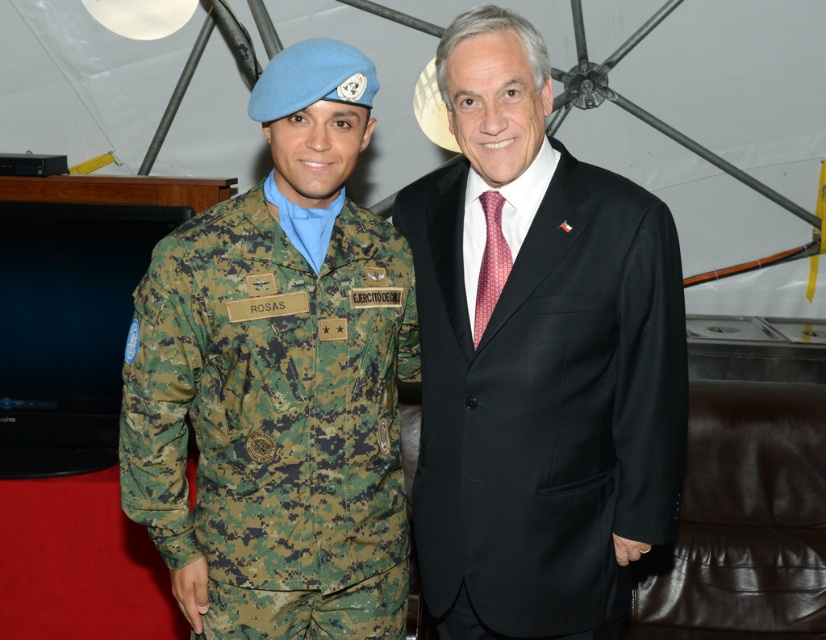
You are an event planner arranging seating for a formal dinner. You need to seat the two individuals shown in the image. The table has a height of 75 cm. Which of the two objects, the black satin suit at center or the camouflagetextured fabric at left, would require a higher chair to accommodate their clothing? Please explain your reasoning based on the provided information.

The black satin suit at center has a greater height compared to the camouflagetextured fabric at left. Therefore, the individual wearing the black satin suit at center would require a higher chair to accommodate their clothing since their outfit is taller.

You are a photographer at a formal event. You need to capture a photo where both the camouflagetextured fabric at left and the red dotted fabric tie at center are clearly visible. Considering their heights, which object should you focus on first to ensure both are in frame?

The camouflagetextured fabric at left is much taller than the red dotted fabric tie at center. To ensure both are in frame, focus on the taller camouflagetextured fabric at left first, then adjust the camera angle to include the shorter red dotted fabric tie at center.

You are a photographer at a formal event. You need to capture a closeup shot of the black satin suit at center and the red dotted fabric tie at center. What is the minimum distance you need to maintain between the camera and the subjects to ensure both are in focus?

The black satin suit at center and red dotted fabric tie at center are 8.37 inches apart, so the minimum distance required to keep both in focus would depend on the camera lens and aperture settings. However, a general rule is to ensure the camera is at least 10 times the distance of the subject separation, so approximately 83.7 inches or about 7 feet away.